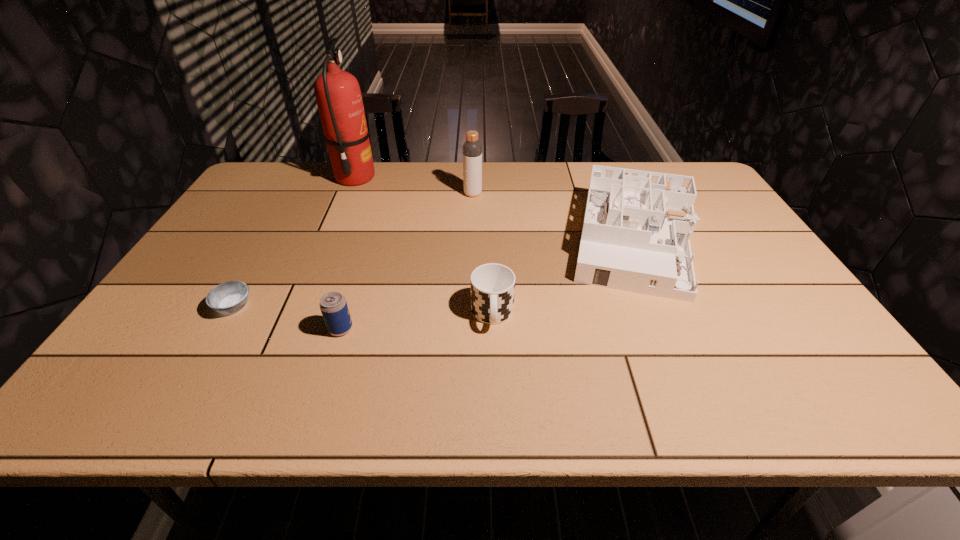
Identify the location of free space between the bottle and the cup. (483, 254).

Where is `vacant area between the second object from left to right and the bottle`? The image size is (960, 540). vacant area between the second object from left to right and the bottle is located at coordinates (414, 186).

Where is `free space between the rightmost object and the ashtray`? free space between the rightmost object and the ashtray is located at coordinates (433, 275).

Identify the location of vacant area that lies between the third tallest object and the fire extinguisher. (493, 211).

Locate an element on the screen. object that is the fifth closest one to the third object from left to right is located at coordinates coord(472,149).

Identify which object is the fifth nearest to the tallest object. Please provide its 2D coordinates. Your answer should be formatted as a tuple, i.e. [(x, y)], where the tuple contains the x and y coordinates of a point satisfying the conditions above.

[(637, 227)]

What are the coordinates of `free spot that satisfies the following two spatial constraints: 1. on the side of the tallest object with the nozzle and handle; 2. on the back side of the rightmost object` in the screenshot? It's located at (327, 244).

Locate an element on the screen. The height and width of the screenshot is (540, 960). free location that satisfies the following two spatial constraints: 1. on the side of the second object from left to right with the nozzle and handle; 2. on the right side of the bottle is located at coordinates (348, 194).

Locate an element on the screen. vacant space that satisfies the following two spatial constraints: 1. on the side of the second object from left to right with the nozzle and handle; 2. on the right side of the third object from left to right is located at coordinates (292, 329).

Locate an element on the screen. This screenshot has width=960, height=540. blank space that satisfies the following two spatial constraints: 1. on the side of the tallest object with the nozzle and handle; 2. on the back side of the second tallest object is located at coordinates (348, 194).